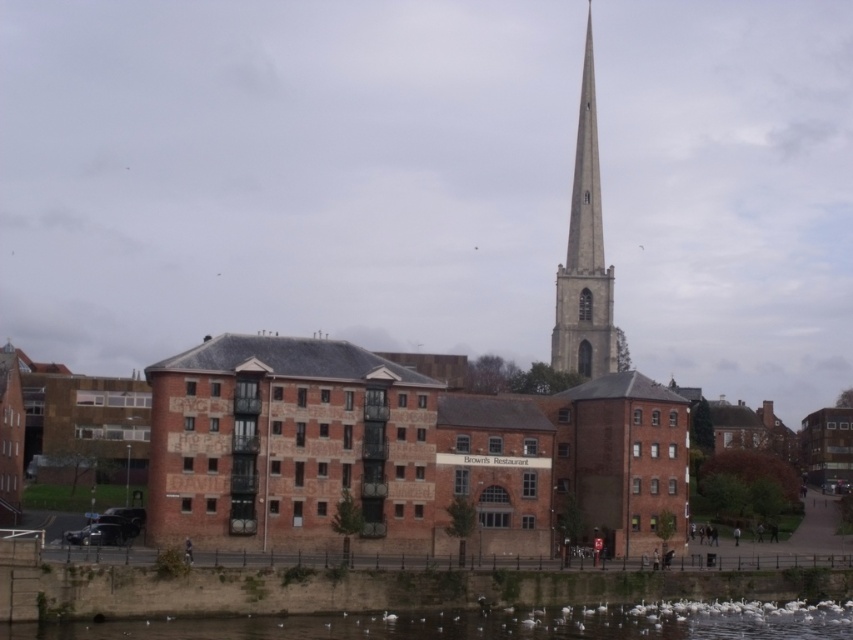
Does white fluffy birds at lower center come behind smooth stone spire at center?

No, it is not.

Which is above, white fluffy birds at lower center or smooth stone spire at center?

smooth stone spire at center

Between point (695, 618) and point (569, 317), which one is positioned behind?

The point (569, 317) is behind.

Find the location of `white fluffy birds at lower center`. white fluffy birds at lower center is located at coordinates (489, 625).

Looking at this image, does brick building at center appear under smooth stone spire at center?

Yes.

Is the position of brick building at center more distant than that of smooth stone spire at center?

No, it is in front of smooth stone spire at center.

Between point (207, 442) and point (611, 362), which one is positioned behind?

The point (611, 362) is behind.

In order to click on brick building at center in this screenshot , I will do point(401,451).

Does brick building at center have a lesser height compared to white fluffy birds at lower center?

Incorrect, brick building at center's height does not fall short of white fluffy birds at lower center's.

The height and width of the screenshot is (640, 853). Identify the location of brick building at center. (401, 451).